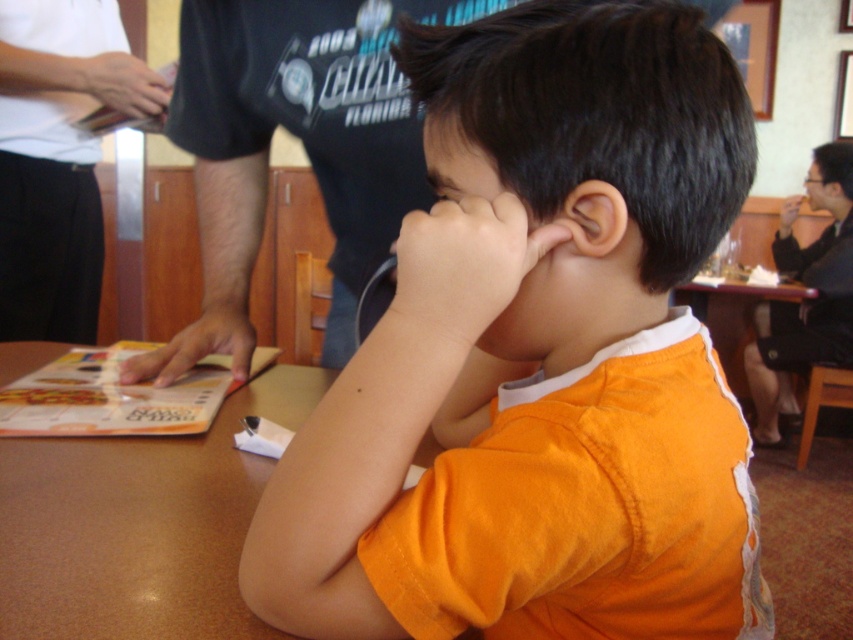
Consider the image. You are a waiter in a restaurant. You need to place a new drink order on the table where the boy is sitting. The boy is at the table with a menu in front of him. Where should you place the drink so it doesn not interfere with the menu or the black cotton shirt at upper center located at point (x=302, y=144)?

The drink should be placed away from the menu and the black cotton shirt at upper center located at point (x=302, y=144) to avoid interference. Since the black cotton shirt is at upper center, placing the drink on the lower part of the table would keep it out of the way.

Where is the black cotton shirt at upper center located in the image?

The black cotton shirt at upper center is located at point coordinates of 0.225 on the x axis and 0.355 on the y axis.

In the scene shown: You are a waiter at a restaurant and you see the matte black hand at upper left and the matte white hand at upper right reaching towards the menu. Which hand is closer to the menu?

The matte black hand at upper left is shorter than the matte white hand at upper right, so the matte black hand at upper left is closer to the menu.